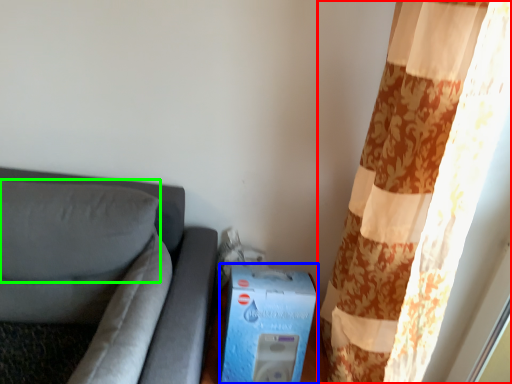
Question: Which is nearer to the curtain (highlighted by a red box)? box (highlighted by a blue box) or pillow (highlighted by a green box).

Choices:
 (A) box
 (B) pillow

Answer: (A)